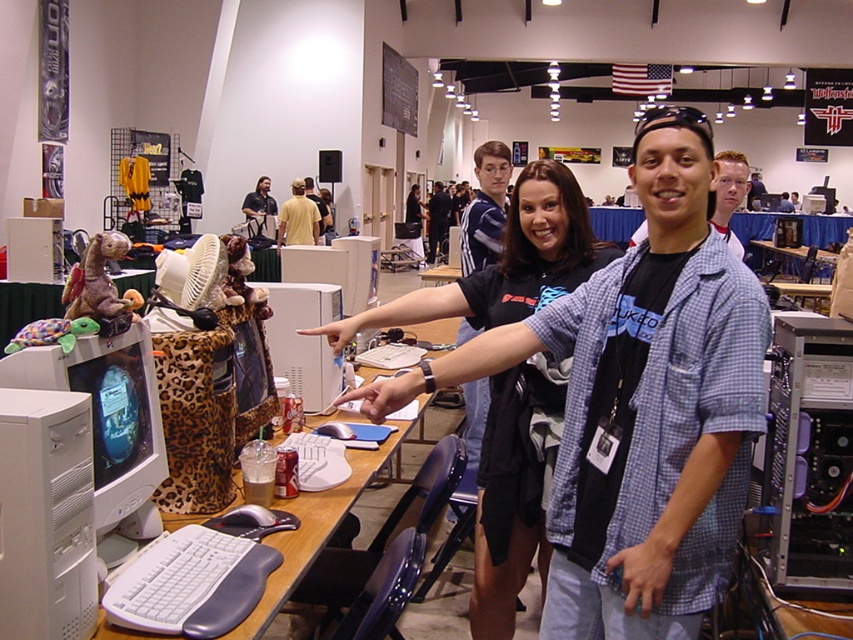
You are standing in the convention center and want to walk towards the two points marked in the image. Which point, point [376,470] or point [265,200], will you reach first?

You will reach point [376,470] first because it is closer to you than point [265,200].

You are a photographer setting up for an event. You need to place a 10cm tall camera tripod on the wooden table at center. The dark brown leather jacket at upper center is currently on the table. Can the tripod be placed on the table without the jacket blocking it?

The wooden table at center has a lesser height compared to dark brown leather jacket at upper center, meaning the jacket is taller than the table. Since the jacket is on the table, it may block the tripod placement. Move the jacket to another location first.